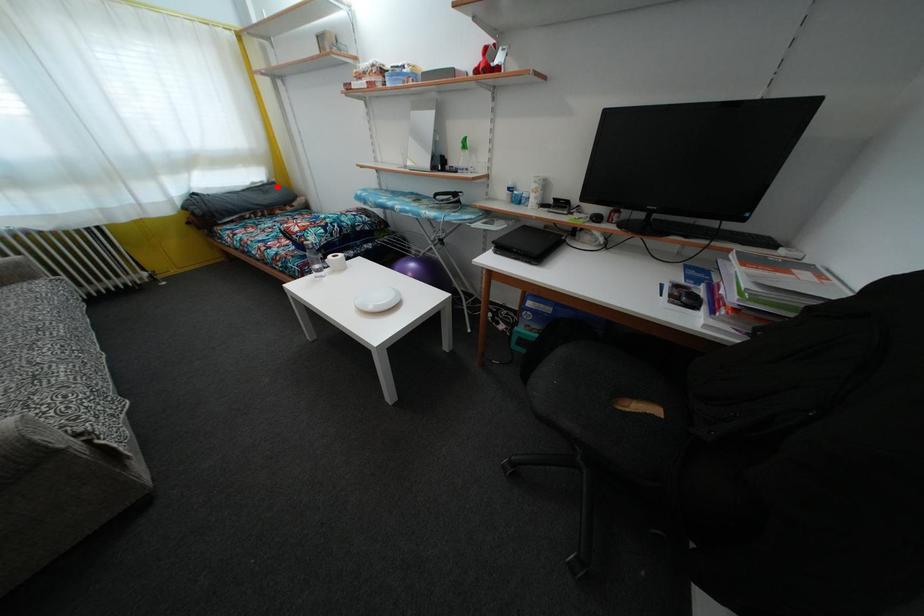
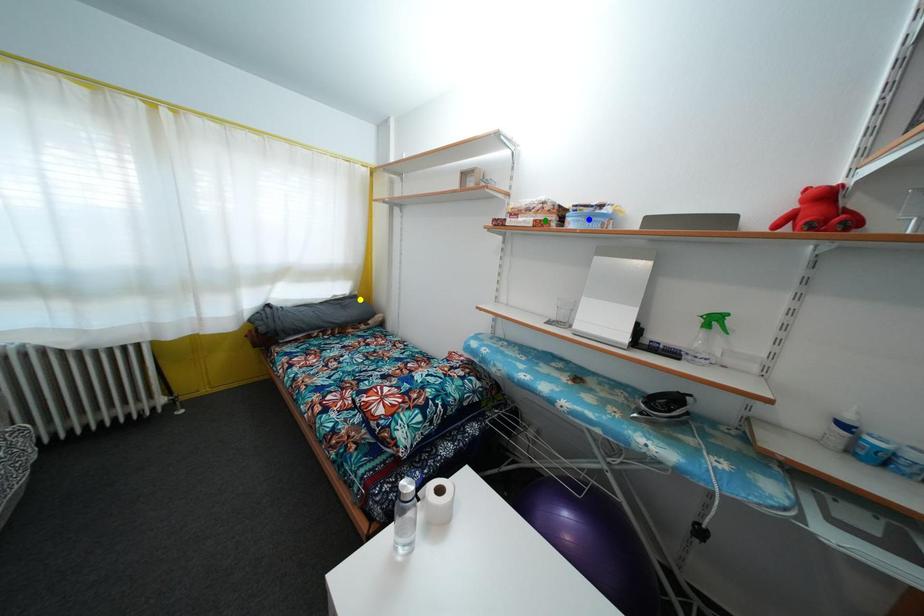
Question: I am providing you with two images of the same scene from different viewpoints. A red point is marked on the first image. You are given multiple points on the second image. Which mark in image 2 goes with the point in image 1?

Choices:
 (A) green point
 (B) blue point
 (C) yellow point

Answer: (C)